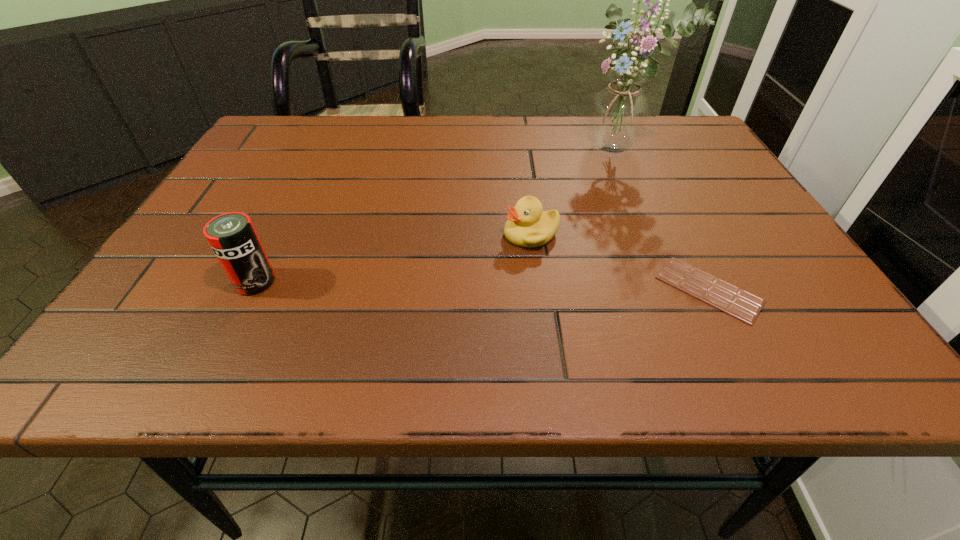
This screenshot has height=540, width=960. I want to click on vacant point located 0.260m on the front-facing side of the tallest object, so click(548, 221).

You are a GUI agent. You are given a task and a screenshot of the screen. Output one action in this format:
    pyautogui.click(x=<x>, y=<y>)
    Task: Click on the free point located 0.140m on the front-facing side of the tallest object
    The width and height of the screenshot is (960, 540).
    Given the screenshot: What is the action you would take?
    pyautogui.click(x=576, y=194)

Image resolution: width=960 pixels, height=540 pixels. I want to click on free space located on the front-facing side of the third object from right to left, so click(388, 309).

The image size is (960, 540). What are the coordinates of `vacant region located on the front-facing side of the third object from right to left` in the screenshot? It's located at (490, 256).

At what (x,y) coordinates should I click in order to perform the action: click on vacant space located on the front-facing side of the third object from right to left. Please return your answer as a coordinate pair (x, y). Looking at the image, I should click on (398, 303).

At what (x,y) coordinates should I click in order to perform the action: click on object located in the far edge section of the desktop. Please return your answer as a coordinate pair (x, y). Image resolution: width=960 pixels, height=540 pixels. Looking at the image, I should click on (618, 117).

This screenshot has width=960, height=540. In order to click on can positioned at the near edge in this screenshot , I will do `click(232, 236)`.

In order to click on chocolate bar at the near edge in this screenshot , I will do `click(745, 306)`.

Where is `object at the left edge`? The width and height of the screenshot is (960, 540). object at the left edge is located at coordinates (232, 236).

Locate an element on the screen. The height and width of the screenshot is (540, 960). chocolate bar present at the right edge is located at coordinates (745, 306).